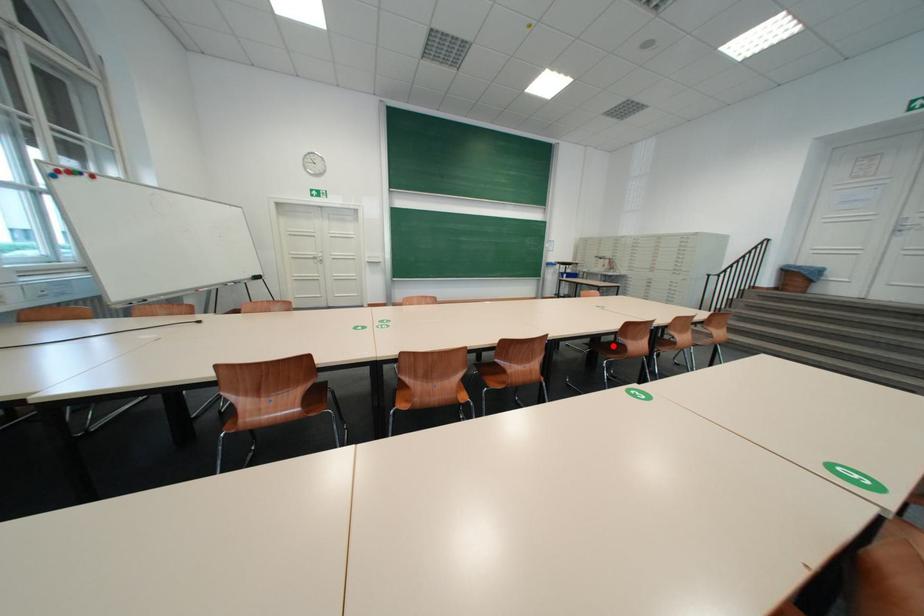
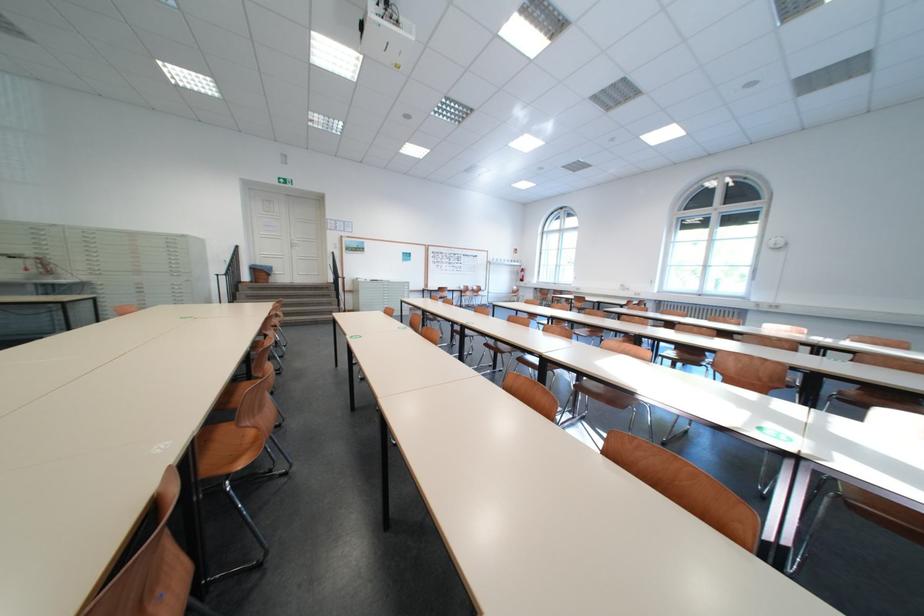
Question: I am providing you with two images of the same scene from different viewpoints. A red point is marked on the first image. Can you still see the location of the red point in image 2?

Choices:
 (A) Yes
 (B) No

Answer: (B)